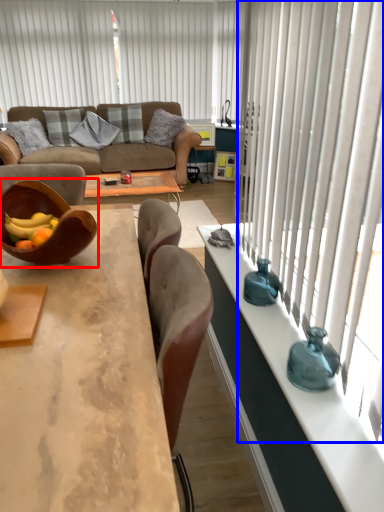
Question: Among these objects, which one is farthest to the camera, bowl (highlighted by a red box) or curtain (highlighted by a blue box)?

Choices:
 (A) bowl
 (B) curtain

Answer: (A)